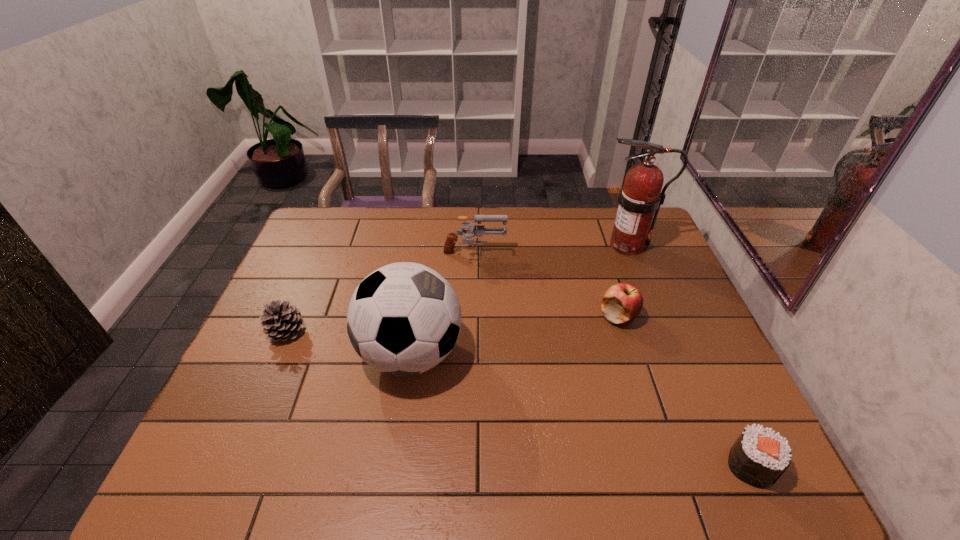
Where is `free space between the second tallest object and the apple`? The width and height of the screenshot is (960, 540). free space between the second tallest object and the apple is located at coordinates (515, 335).

At what (x,y) coordinates should I click in order to perform the action: click on unoccupied area between the fire extinguisher and the gun. Please return your answer as a coordinate pair (x, y). Looking at the image, I should click on (551, 251).

You are a GUI agent. You are given a task and a screenshot of the screen. Output one action in this format:
    pyautogui.click(x=<x>, y=<y>)
    Task: Click on the free spot between the fifth shortest object and the tallest object
    
    Given the screenshot: What is the action you would take?
    pyautogui.click(x=519, y=300)

I want to click on empty location between the second tallest object and the sushi, so tap(581, 409).

In order to click on free space between the apple and the gun in this screenshot , I will do `click(546, 286)`.

Where is `unoccupied position between the leftmost object and the fifth shortest object`? unoccupied position between the leftmost object and the fifth shortest object is located at coordinates click(348, 343).

This screenshot has width=960, height=540. What are the coordinates of `vacant area between the fire extinguisher and the shortest object` in the screenshot? It's located at (689, 355).

Locate an element on the screen. free space between the fourth shortest object and the nearest object is located at coordinates (612, 360).

Identify which object is the third nearest to the fire extinguisher. Please provide its 2D coordinates. Your answer should be formatted as a tuple, i.e. [(x, y)], where the tuple contains the x and y coordinates of a point satisfying the conditions above.

[(403, 319)]

This screenshot has height=540, width=960. I want to click on object that is the third closest to the soccer ball, so click(x=622, y=303).